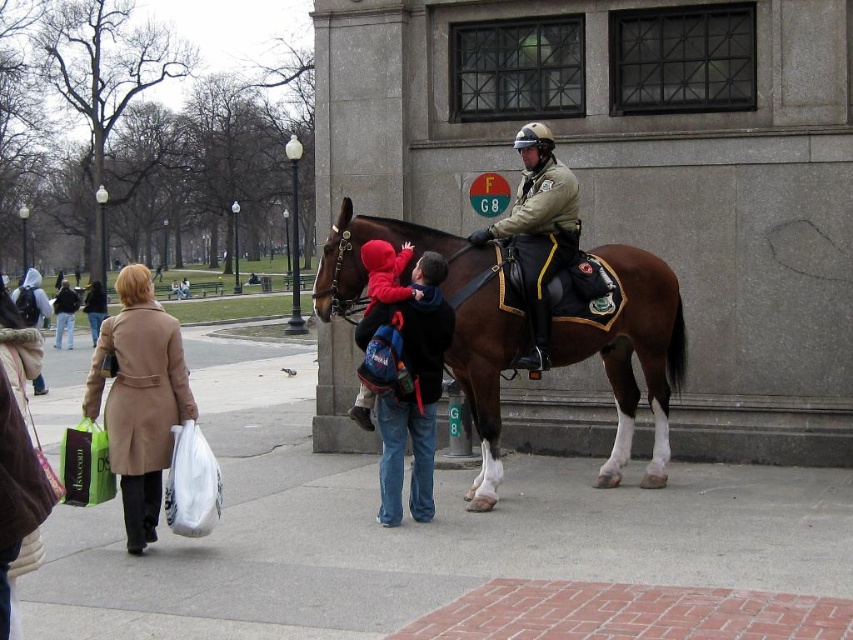
Is brown glossy horse at center wider than matte brown uniform at center?

Yes, brown glossy horse at center is wider than matte brown uniform at center.

Between point (494, 314) and point (543, 269), which one is positioned behind?

Positioned behind is point (543, 269).

The height and width of the screenshot is (640, 853). Describe the element at coordinates (454, 317) in the screenshot. I see `brown glossy horse at center` at that location.

Identify the location of brown glossy horse at center. (454, 317).

Is brown glossy horse at center thinner than beige wool coat at left?

Incorrect, brown glossy horse at center's width is not less than beige wool coat at left's.

The width and height of the screenshot is (853, 640). What do you see at coordinates (454, 317) in the screenshot? I see `brown glossy horse at center` at bounding box center [454, 317].

Who is more forward, (355,221) or (155,376)?

Point (155,376)

At what (x,y) coordinates should I click in order to perform the action: click on brown glossy horse at center. Please return your answer as a coordinate pair (x, y). Looking at the image, I should click on (454, 317).

Who is more forward, (561, 544) or (372, 396)?

Point (561, 544)

Identify the location of concrete sidewalk at lower center. The height and width of the screenshot is (640, 853). (410, 531).